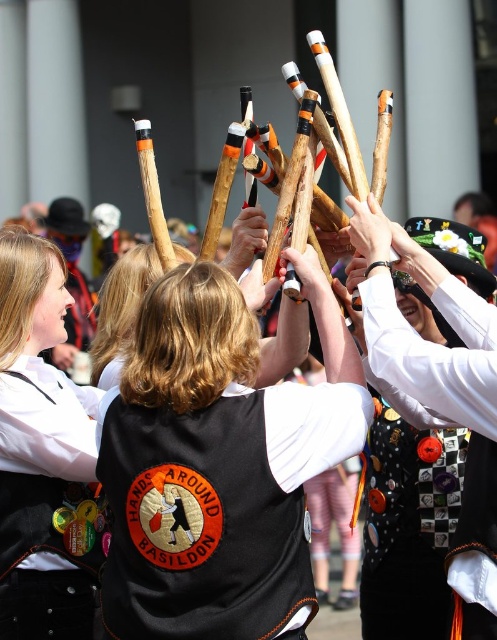
Question: Can you confirm if black fabric vest at center is positioned below matte black vest at center?

Choices:
 (A) no
 (B) yes

Answer: (B)

Question: Can you confirm if black fabric vest at center is bigger than matte black vest at center?

Choices:
 (A) yes
 (B) no

Answer: (A)

Question: Among these objects, which one is farthest from the camera?

Choices:
 (A) black fabric vest at center
 (B) matte black vest at center

Answer: (B)

Question: Does black fabric vest at center appear over matte black vest at center?

Choices:
 (A) no
 (B) yes

Answer: (A)